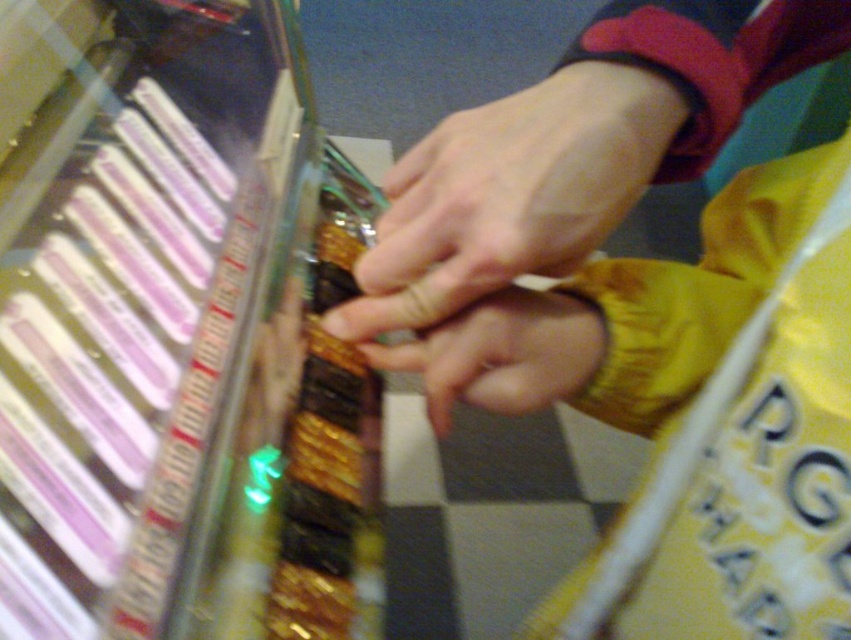
Question: Can you confirm if yellow fabric at center is bigger than smooth skin hand at center?

Choices:
 (A) yes
 (B) no

Answer: (A)

Question: Which point is closer to the camera?

Choices:
 (A) smooth skin hand at center
 (B) yellow fabric at center

Answer: (B)

Question: Which point is farther to the camera?

Choices:
 (A) (448, 240)
 (B) (772, 384)

Answer: (B)

Question: Does yellow fabric at center appear over smooth skin hand at center?

Choices:
 (A) no
 (B) yes

Answer: (A)

Question: Which point appears closest to the camera in this image?

Choices:
 (A) (812, 376)
 (B) (506, 248)

Answer: (B)

Question: Can you confirm if yellow fabric at center is bigger than smooth skin hand at center?

Choices:
 (A) yes
 (B) no

Answer: (A)